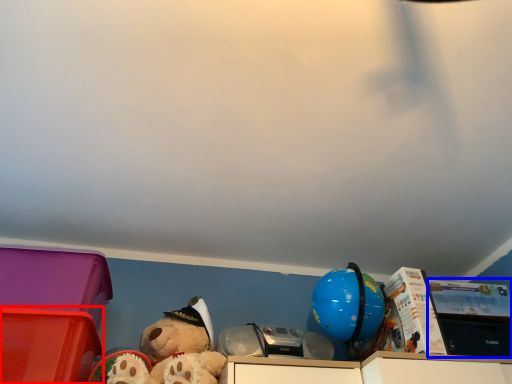
Question: Which point is closer to the camera, storage box (highlighted by a red box) or storage box (highlighted by a blue box)?

Choices:
 (A) storage box
 (B) storage box

Answer: (A)